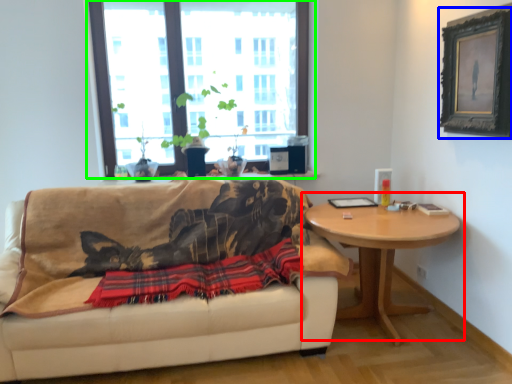
Question: Considering the real-world distances, which object is closest to coffee table (highlighted by a red box)? picture frame (highlighted by a blue box) or window (highlighted by a green box).

Choices:
 (A) picture frame
 (B) window

Answer: (A)